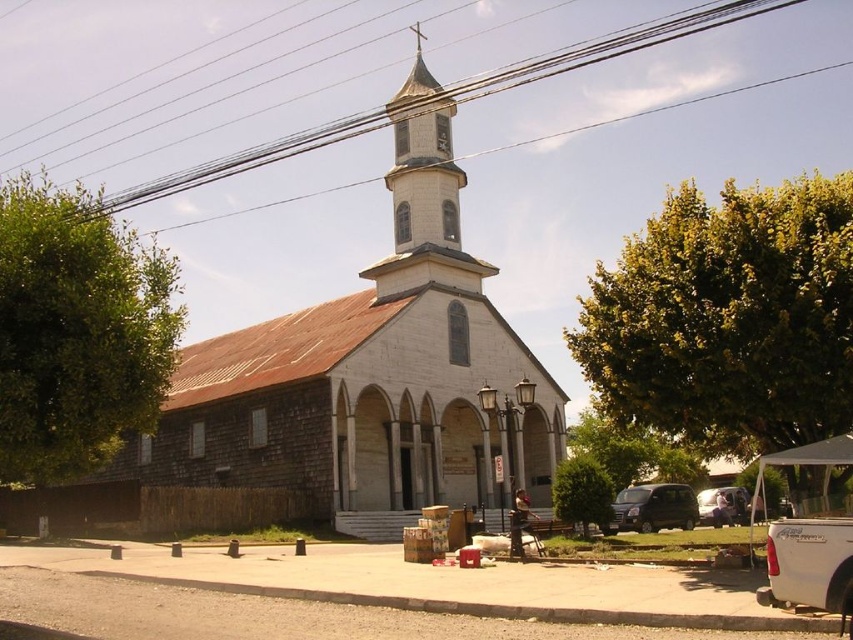
Question: Can you confirm if white wood church at center is smaller than metallic wire at upper center?

Choices:
 (A) no
 (B) yes

Answer: (B)

Question: Which of the following is the farthest from the observer?

Choices:
 (A) white matte truck at lower right
 (B) matte black van at lower right
 (C) metallic wire at upper center
 (D) white stone bell tower at upper center

Answer: (D)

Question: Can you confirm if metallic wire at upper center is thinner than matte black van at lower right?

Choices:
 (A) yes
 (B) no

Answer: (B)

Question: Which point is farther to the camera?

Choices:
 (A) (413, 177)
 (B) (128, 451)

Answer: (A)

Question: Does white stone bell tower at upper center come behind metallic silver van at lower right?

Choices:
 (A) yes
 (B) no

Answer: (A)

Question: Based on their relative distances, which object is farther from the white wood church at center?

Choices:
 (A) white stone bell tower at upper center
 (B) metallic silver van at lower right
 (C) metallic wire at upper center

Answer: (B)